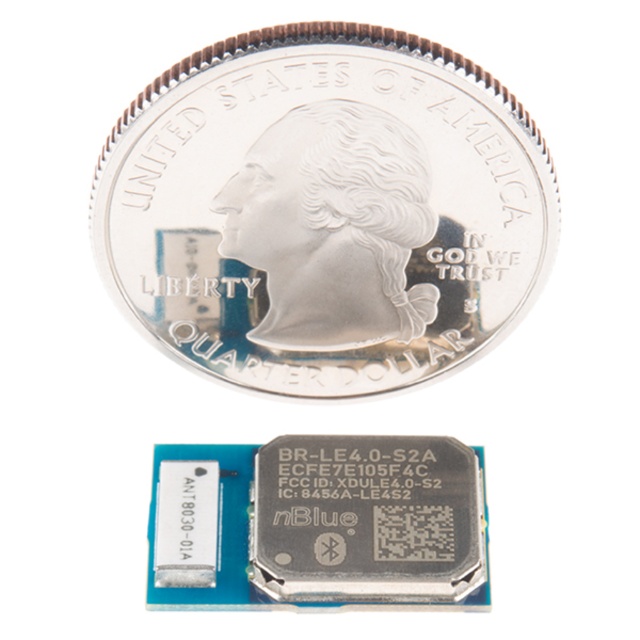
Which of these two, silver metallic coin at center or silver metallic coin at upper center, stands taller?

With more height is silver metallic coin at center.

Is point (332, 186) positioned before point (397, 481)?

Yes, it is.

Locate an element on the screen. This screenshot has width=640, height=640. silver metallic coin at center is located at coordinates click(324, 209).